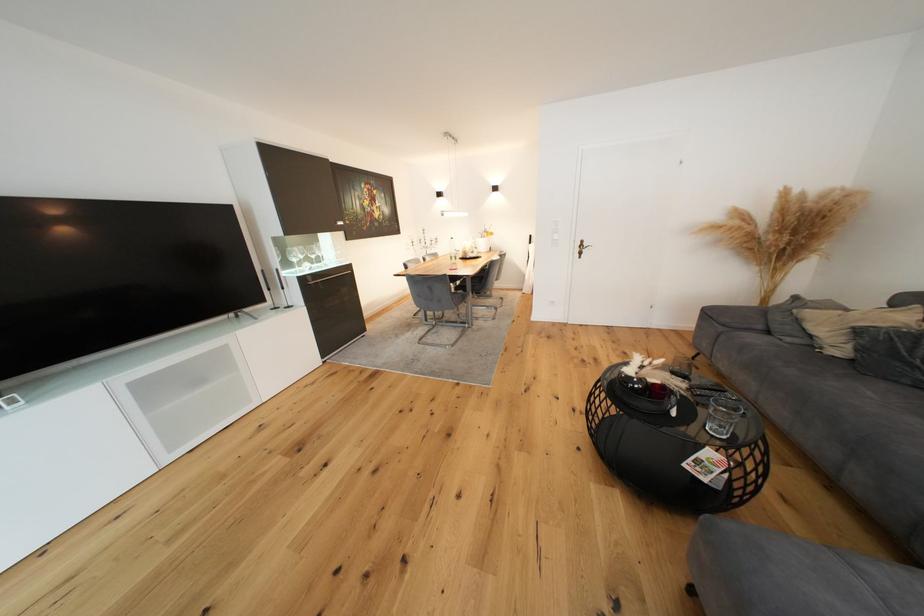
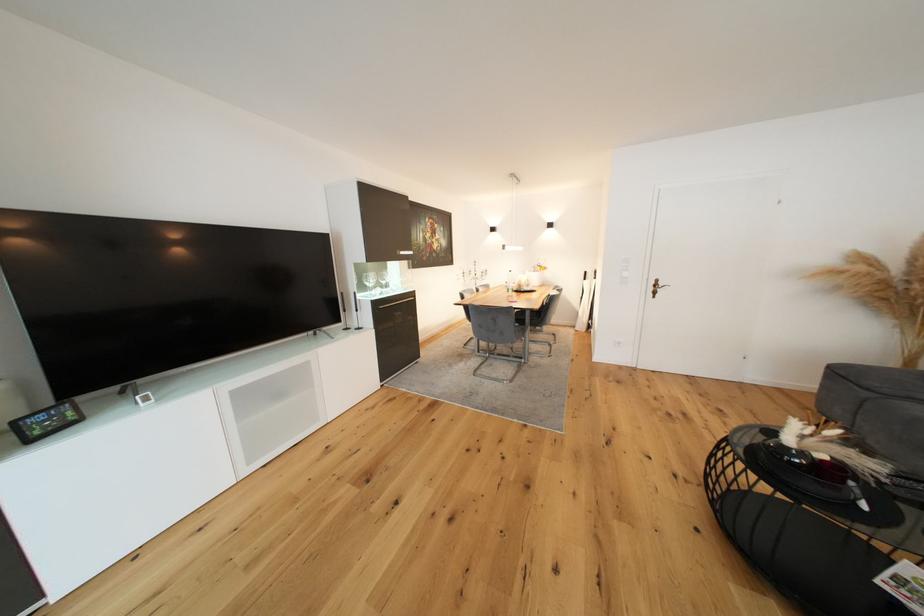
Find the pixel in the second image that matches [272,302] in the first image.

(346, 323)